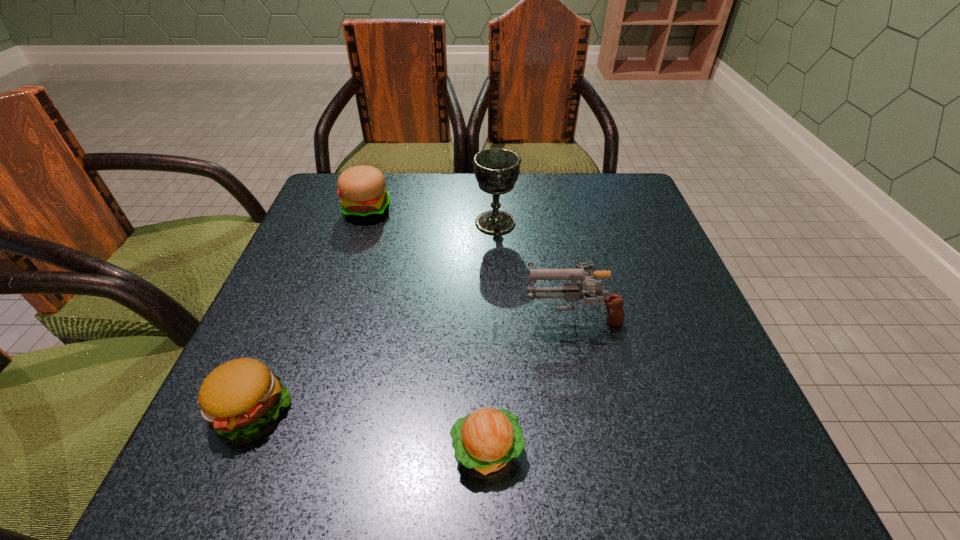
At what (x,y) coordinates should I click in order to perform the action: click on free region at the right edge. Please return your answer as a coordinate pair (x, y). This screenshot has width=960, height=540. Looking at the image, I should click on (647, 347).

This screenshot has width=960, height=540. In the image, there is a desktop. Find the location of `free space at the far left corner`. free space at the far left corner is located at coordinates (330, 179).

The image size is (960, 540). In the image, there is a desktop. What are the coordinates of `free space at the near left corner` in the screenshot? It's located at (188, 481).

Where is `free space at the far right corner`? free space at the far right corner is located at coordinates (600, 209).

What are the coordinates of `free area in between the tallest hamburger and the tallest object` in the screenshot? It's located at (431, 216).

Image resolution: width=960 pixels, height=540 pixels. What are the coordinates of `empty location between the tallest object and the third tallest object` in the screenshot? It's located at (431, 216).

I want to click on free spot between the farthest hamburger and the rightmost hamburger, so click(427, 330).

Where is `free space between the chalice and the third shortest object`? This screenshot has width=960, height=540. free space between the chalice and the third shortest object is located at coordinates [431, 216].

Locate an element on the screen. object that ranks as the third closest to the rightmost hamburger is located at coordinates (496, 170).

The height and width of the screenshot is (540, 960). What are the coordinates of `the third closest object to the rightmost hamburger` in the screenshot? It's located at (496, 170).